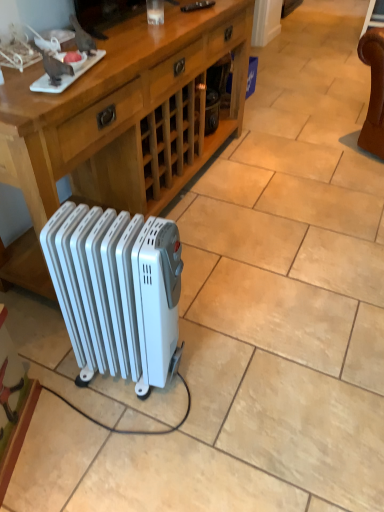
In order to click on free location to the right of white plastic radiator at lower center in this screenshot , I will do `click(222, 369)`.